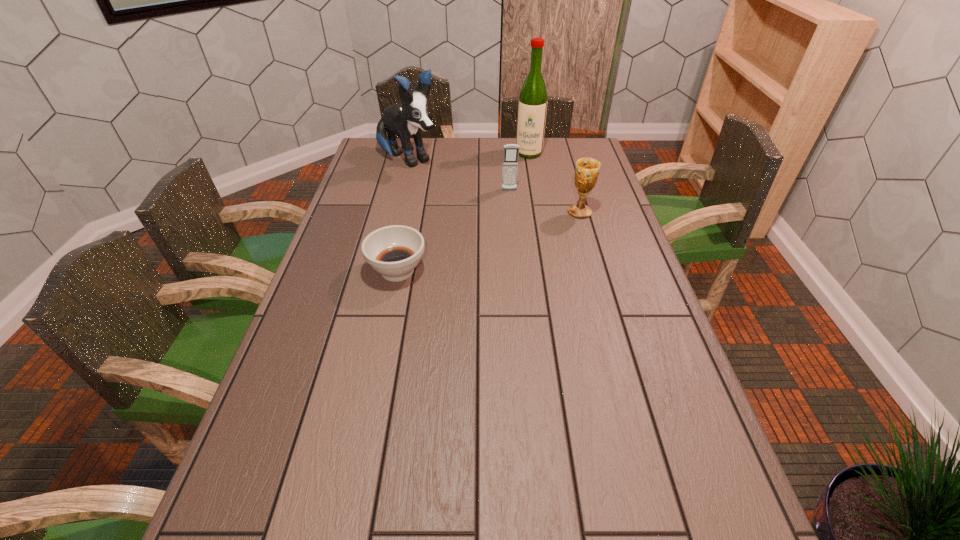
This screenshot has width=960, height=540. In order to click on free space on the desktop that is between the soup bowl and the rightmost object and is positioned on the front-facing side of the third nearest object in this screenshot , I will do `click(514, 233)`.

Locate an element on the screen. The width and height of the screenshot is (960, 540). free spot on the desktop that is between the nearest object and the rightmost object and is positioned on the label of the liquor is located at coordinates (509, 235).

Identify the location of free spot on the desktop that is between the soup bowl and the chalice and is positioned on the front-facing side of the second tallest object. (513, 234).